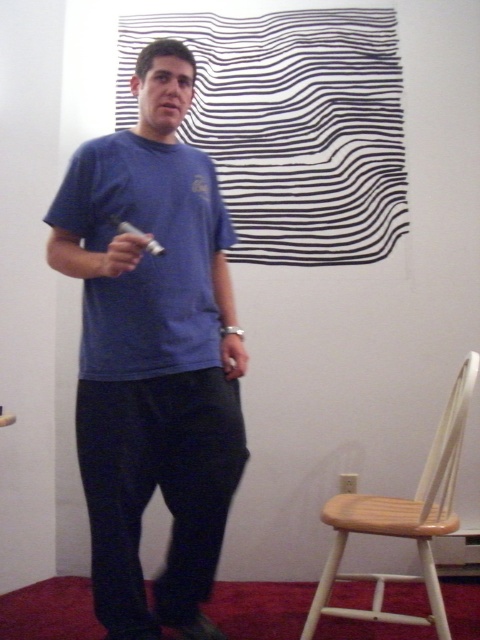
The image size is (480, 640). Find the location of `blue cotton shirt at center`. blue cotton shirt at center is located at coordinates (154, 355).

Which is below, blue cotton shirt at center or matte white remote at center?

blue cotton shirt at center is below.

Is point (196, 484) behind point (130, 269)?

Yes, it is.

In order to click on blue cotton shirt at center in this screenshot , I will do `click(154, 355)`.

Can you confirm if blue cotton shirt at center is positioned to the right of wooden at right?

No, blue cotton shirt at center is not to the right of wooden at right.

Describe the element at coordinates (154, 355) in the screenshot. I see `blue cotton shirt at center` at that location.

Is point (146, 460) closer to viewer compared to point (432, 602)?

Yes, point (146, 460) is closer to viewer.

Identify the location of blue cotton shirt at center. This screenshot has height=640, width=480. (154, 355).

Between point (342, 490) and point (133, 259), which one is positioned in front?

Point (133, 259)

Who is lower down, wooden at right or matte white remote at center?

wooden at right

Is point (336, 500) farther from viewer compared to point (132, 243)?

Yes, point (336, 500) is farther from viewer.

Image resolution: width=480 pixels, height=640 pixels. I want to click on wooden at right, so click(400, 518).